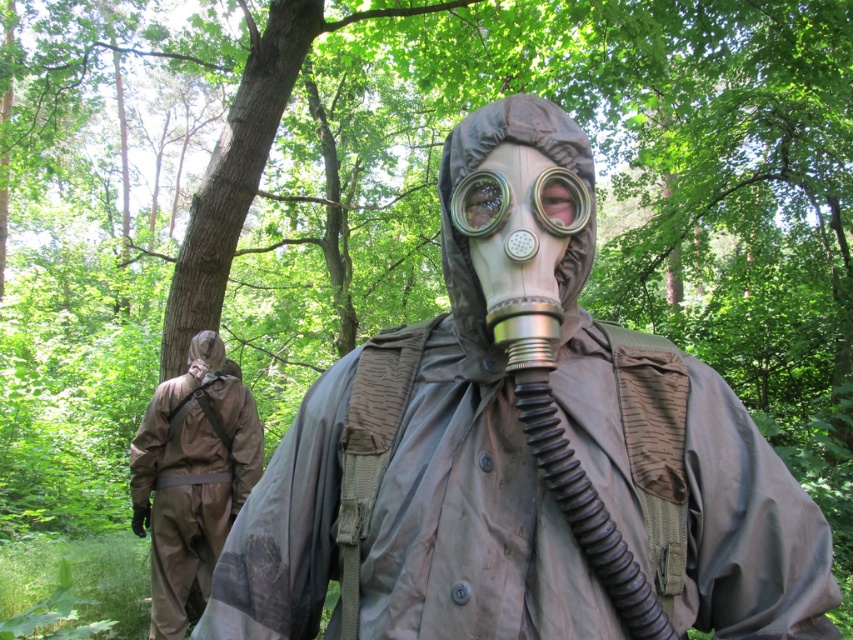
You are a safety inspector in the forest. You need to check the distance between the tan fabric hazmat suit at rear and the clear plastic goggles at center. According to the scene, are they within a 3 meter safety zone?

The tan fabric hazmat suit at rear and clear plastic goggles at center are 3.40 meters apart, which exceeds the 3 meter safety zone requirement.

You are standing at the point marked as point (x=523, y=499) in the forest scene. If you want to move 40 inches forward in the direction you are facing, will you be able to do so without encountering any obstacles?

The distance between point (x=523, y=499) and the viewer is 34.14 inches. Since you want to move 40 inches forward, which is more than the available distance, you will not be able to move the full 40 inches without encountering an obstacle.